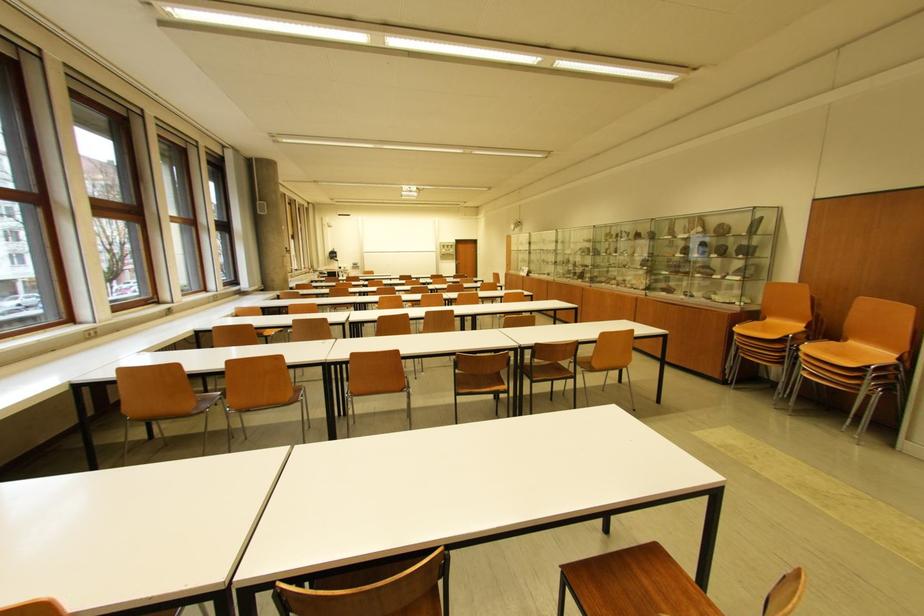
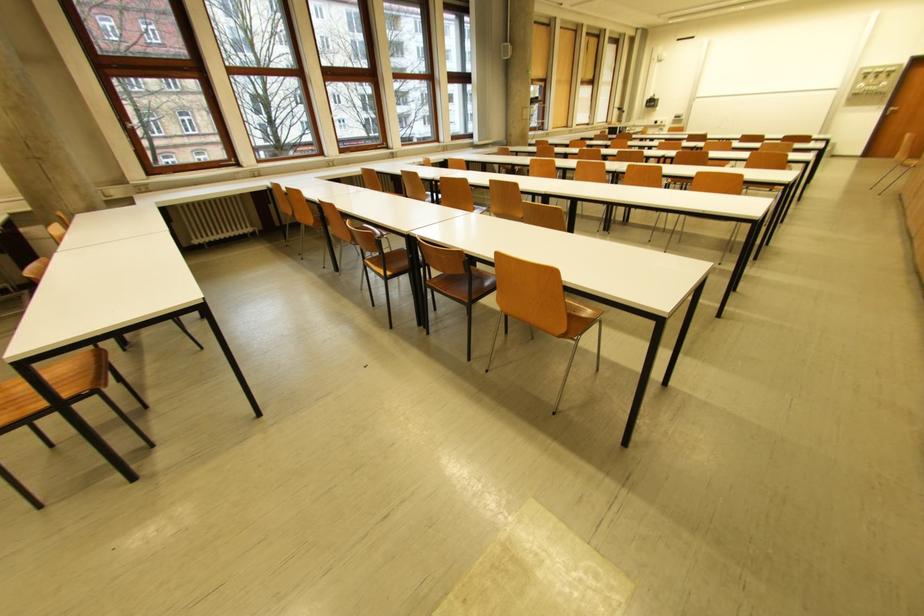
Find the pixel in the second image that matches pixel 462 262 in the first image.

(891, 108)